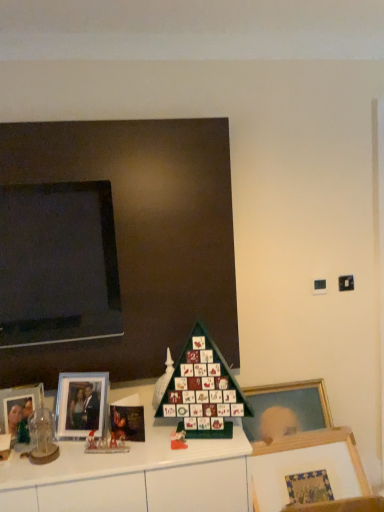
The image size is (384, 512). I want to click on free space between matte glass picture frame at left, acting as the 3th picture frame starting from the right, and matte plastic advent calendar at center, which ranks as the 1th toy in right-to-left order, so click(x=92, y=445).